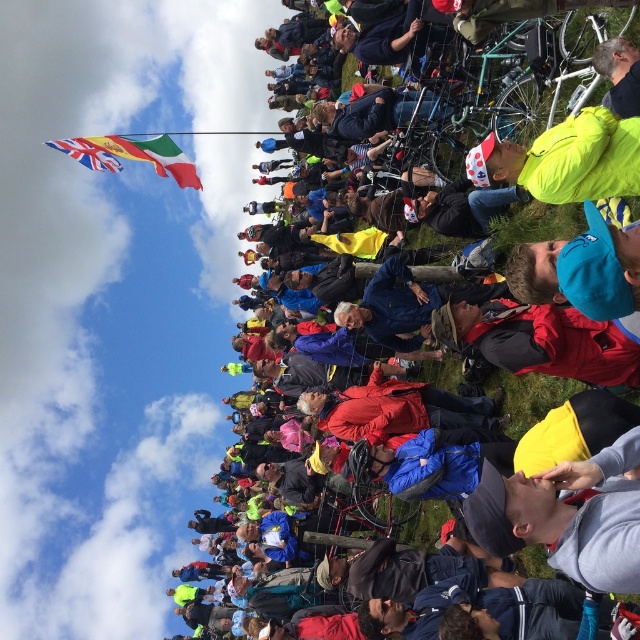
You are a photographer at the event, and you want to capture both the blue fabric jacket at upper center and the yellow jacket at upper right in your shot. Which jacket will appear larger in the photo?

The blue fabric jacket at upper center will appear larger in the photo because it has a greater height compared to the yellow jacket at upper right.

You are a photographer at the event and want to take a photo of the yellow jacket at upper right without the union jack fabric flag at upper left blocking it. What should you do?

Move to the side so the yellow jacket at upper right is no longer behind the union jack fabric flag at upper left.